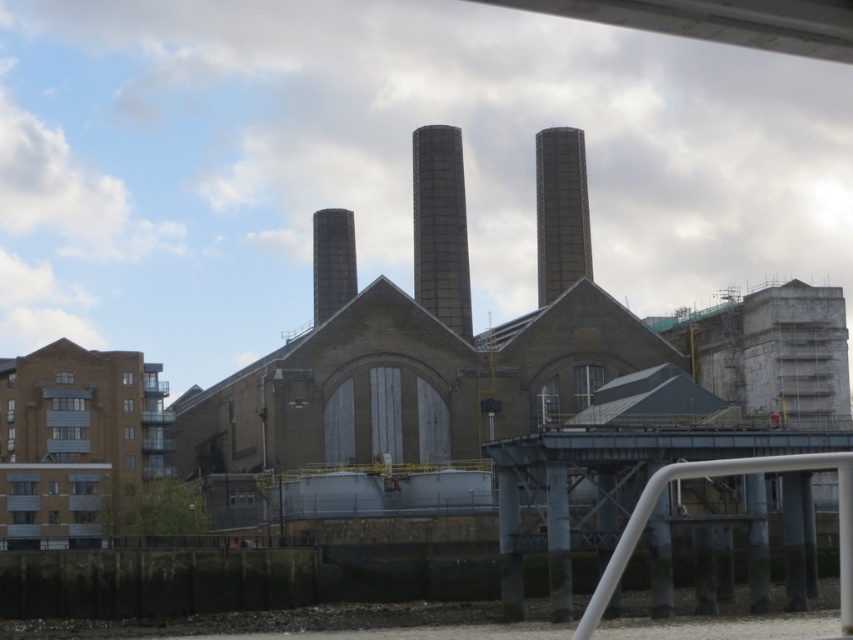
You are standing at the point with coordinates (x=721, y=476) in the image. What object is located at this point?

The white metallic rail at lower right is located at point (x=721, y=476).

You are a maintenance worker needing to inspect the white metallic rail at lower right and the dark gray textured chimney at center. The safety protocol requires you to stay within 50 meters of the building. Which object can you safely inspect without violating the protocol?

The white metallic rail at lower right is 60.09 meters away from the dark gray textured chimney at center. Since the safety protocol requires staying within 50 meters of the building, you can only safely inspect the dark gray textured chimney at center because it is closer to the building. The white metallic rail at lower right is farther away and exceeds the 50 meters limit.

You are an engineer inspecting the industrial site. You need to determine which chimney has a wider base. You observe the dark gray concrete chimney at center and the smooth gray chimney at center. Which one has a wider base?

The smooth gray chimney at center has a wider base than the dark gray concrete chimney at center.